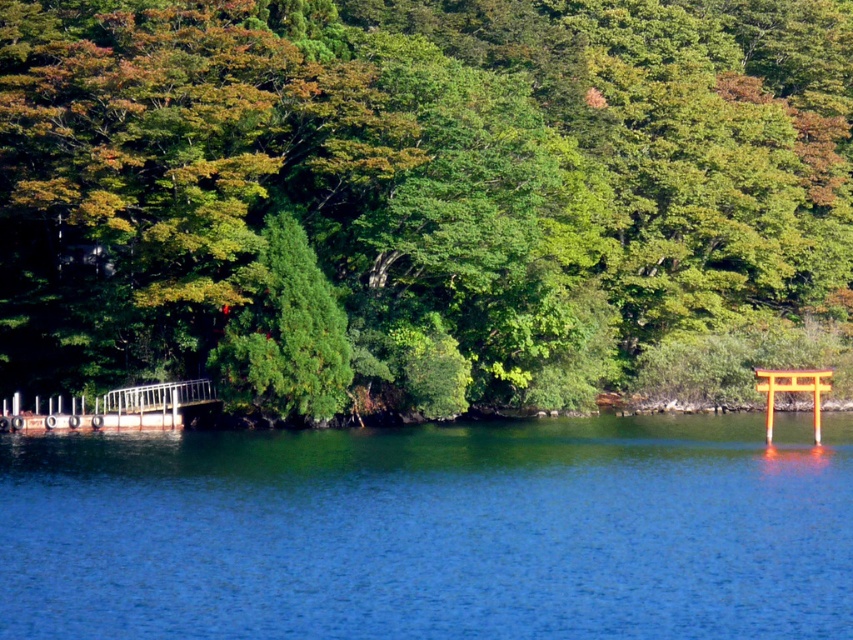
Question: Can you confirm if green leafy tree at center is positioned above blue liquid at center?

Choices:
 (A) no
 (B) yes

Answer: (B)

Question: Which is nearer to the rusty metal dock at lower left?

Choices:
 (A) blue liquid at center
 (B) orange glossy torii gate at right
 (C) green leafy tree at center

Answer: (C)

Question: Considering the relative positions of blue liquid at center and rusty metal dock at lower left in the image provided, where is blue liquid at center located with respect to rusty metal dock at lower left?

Choices:
 (A) above
 (B) below

Answer: (B)

Question: Which point is closer to the camera?

Choices:
 (A) (770, 419)
 (B) (839, 632)
 (C) (108, 412)
 (D) (107, 125)

Answer: (B)

Question: Which point is closer to the camera?

Choices:
 (A) tap(769, 563)
 (B) tap(15, 420)

Answer: (A)

Question: Can you confirm if green leafy tree at center is smaller than rusty metal dock at lower left?

Choices:
 (A) no
 (B) yes

Answer: (A)